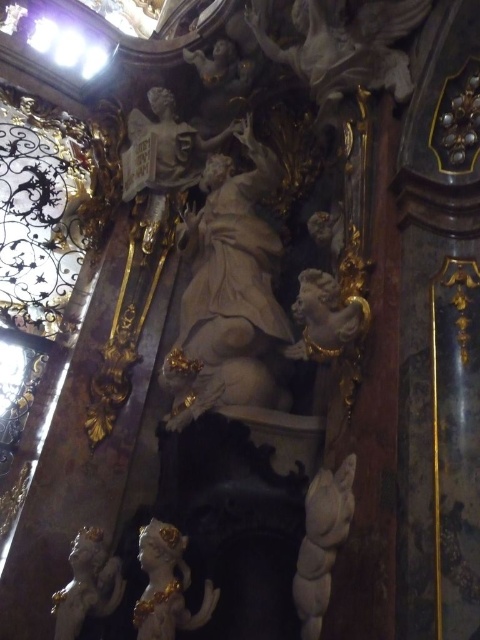
You are an art conservator examining the Baroque interior scene. You need to determine which object is taller between the white marble statue at center and the white marble cherub at center. Based on the scene, which one is taller?

The white marble statue at center is taller than the white marble cherub at center.

You are an art conservator tasked with measuring the width of two statues in the cathedral. You observe the white marble statue at center and the golden polished statue at center. Which statue has a greater width?

The white marble statue at center has a greater width than the golden polished statue at center according to the description provided.

You are an art restorer examining the Baroque statue and its surroundings. You notice both the white marble cherub at center and the golden polished statue at center. Which object is closer to your current position as you examine them?

The white marble cherub at center is closer to you than the golden polished statue at center because it is further to the viewer.